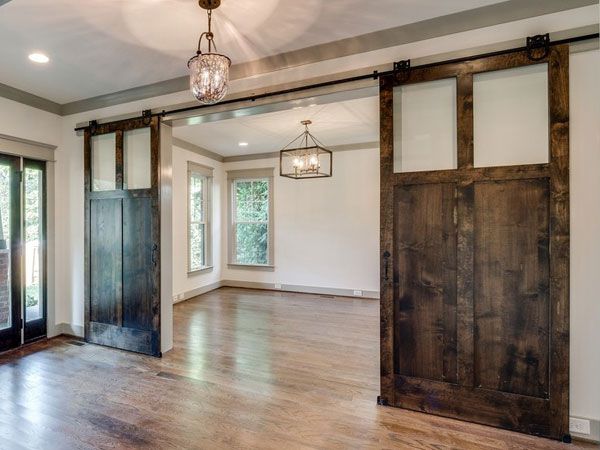
I want to click on rail attached to sliding doors, so [x=353, y=77].